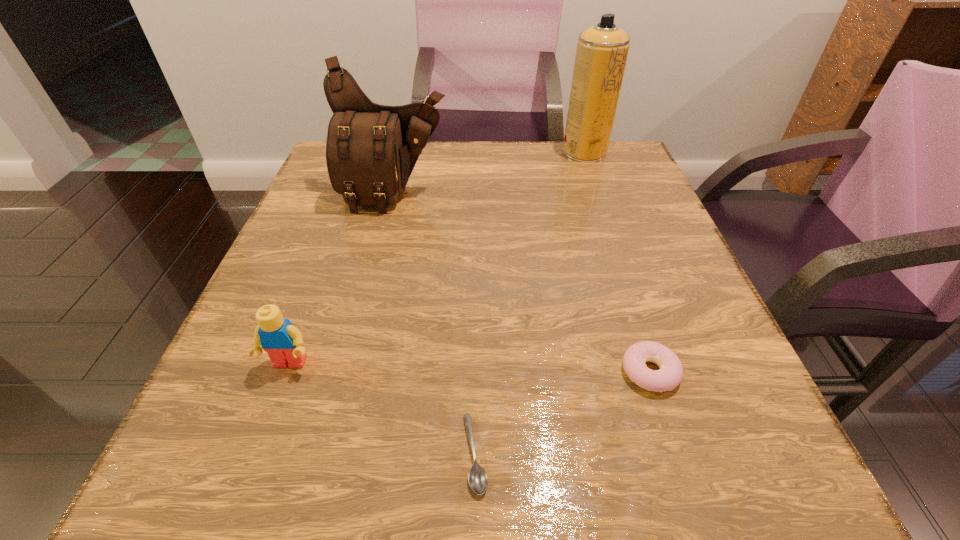
This screenshot has height=540, width=960. Find the location of `vacant region located on the back of the soupspoon`. vacant region located on the back of the soupspoon is located at coordinates (477, 252).

Locate an element on the screen. aerosol can that is at the far edge is located at coordinates (602, 50).

Locate an element on the screen. The height and width of the screenshot is (540, 960). shoulder bag present at the far edge is located at coordinates (371, 150).

Where is `object located at the near edge`? object located at the near edge is located at coordinates (478, 480).

This screenshot has height=540, width=960. What are the coordinates of `shoulder bag at the left edge` in the screenshot? It's located at (371, 150).

The height and width of the screenshot is (540, 960). Find the location of `Lego present at the left edge`. Lego present at the left edge is located at coordinates (278, 337).

Where is `aerosol can at the right edge`? The image size is (960, 540). aerosol can at the right edge is located at coordinates (602, 50).

You are a GUI agent. You are given a task and a screenshot of the screen. Output one action in this format:
    pyautogui.click(x=<x>, y=<y>)
    Task: Click on the doughnut that is at the right edge
    
    Given the screenshot: What is the action you would take?
    pyautogui.click(x=669, y=376)

Locate an element on the screen. The height and width of the screenshot is (540, 960). object at the far left corner is located at coordinates (371, 150).

Where is `object that is at the far right corner`? object that is at the far right corner is located at coordinates (602, 50).